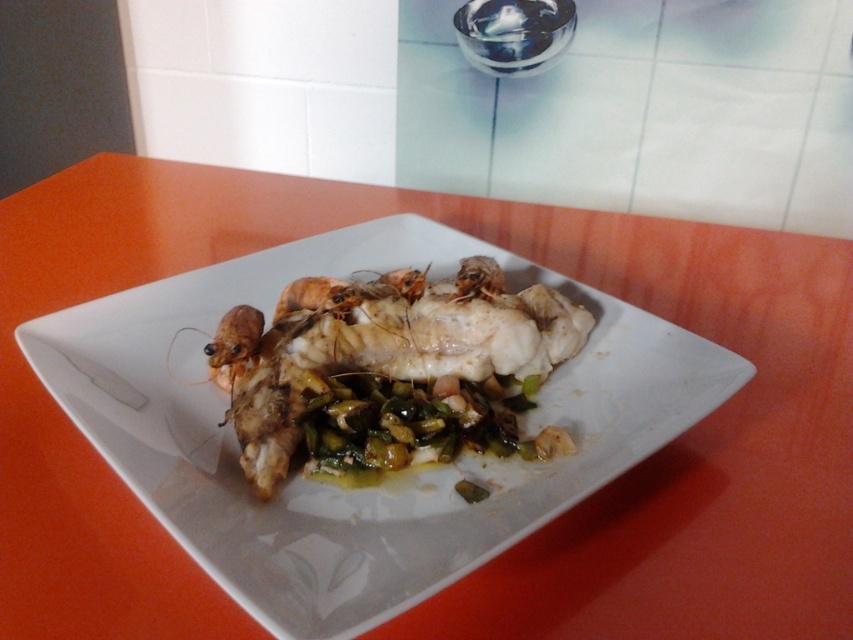
You are a waiter who needs to place a small salt shaker between the white glossy fish at center and the white paper towel at upper center. Based on their positions, where should you place the salt shaker?

The salt shaker should be placed between the white glossy fish at center and the white paper towel at upper center, to the right of the white glossy fish at center and to the left of the white paper towel at upper center since the fish is on the left side of the paper towel.

You are a chef who needs to place a 70 cm long carving knife between the white glossy fish at center and the white paper towel at upper center. Will the knife fit without overlapping either object?

The distance between the white glossy fish at center and the white paper towel at upper center is 69.87 centimeters. Since the knife is 70 cm long, it will not fit without overlapping the objects because the distance is slightly shorter than the knife.

You are a server who needs to check if the white glossy fish at center can be fully covered by the white paper towel at upper center. Based on their sizes, what should you do?

The white glossy fish at center is larger than the white paper towel at upper center, so the paper towel cannot fully cover the fish. You should use a larger towel or an alternative method to cover it.